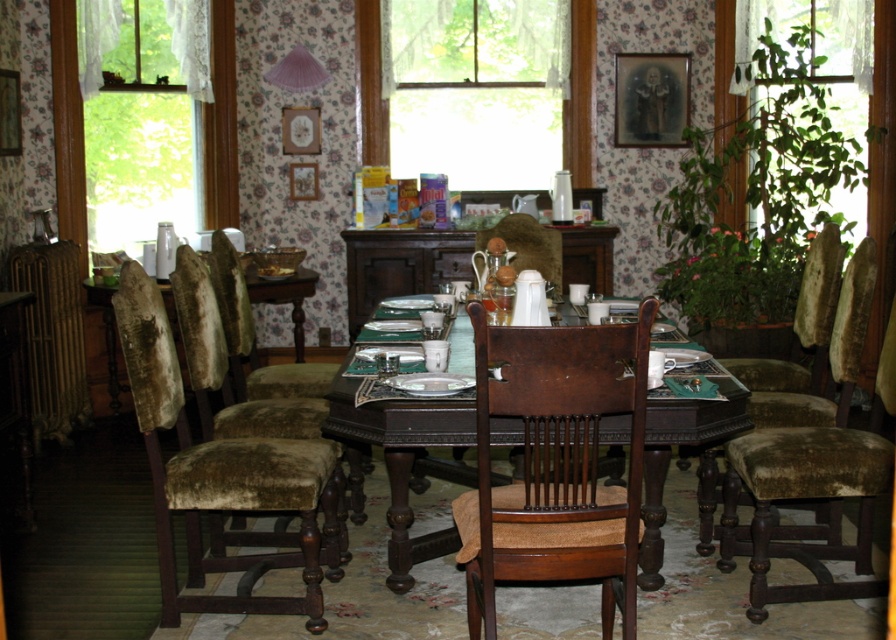
Does velvet green chair at left appear over transparent lace curtain at upper left?

No, velvet green chair at left is not above transparent lace curtain at upper left.

The width and height of the screenshot is (896, 640). I want to click on velvet green chair at left, so click(221, 472).

Is point (254, 554) less distant than point (220, 88)?

Yes.

Where is `velvet green chair at left`? This screenshot has height=640, width=896. velvet green chair at left is located at coordinates (221, 472).

Who is shorter, transparent lace curtain at upper left or velvet green table at left?

With less height is velvet green table at left.

Between transparent lace curtain at upper left and velvet green table at left, which one is positioned higher?

transparent lace curtain at upper left is above.

Identify the location of transparent lace curtain at upper left. The width and height of the screenshot is (896, 640). tap(220, 122).

The image size is (896, 640). I want to click on transparent lace curtain at upper left, so click(x=220, y=122).

Between transparent lace curtain at upper left and transparent glass window at center, which one is positioned lower?

transparent lace curtain at upper left is lower down.

Locate an element on the screen. The width and height of the screenshot is (896, 640). transparent lace curtain at upper left is located at coordinates (220, 122).

At what (x,y) coordinates should I click in order to perform the action: click on transparent lace curtain at upper left. Please return your answer as a coordinate pair (x, y). Looking at the image, I should click on (220, 122).